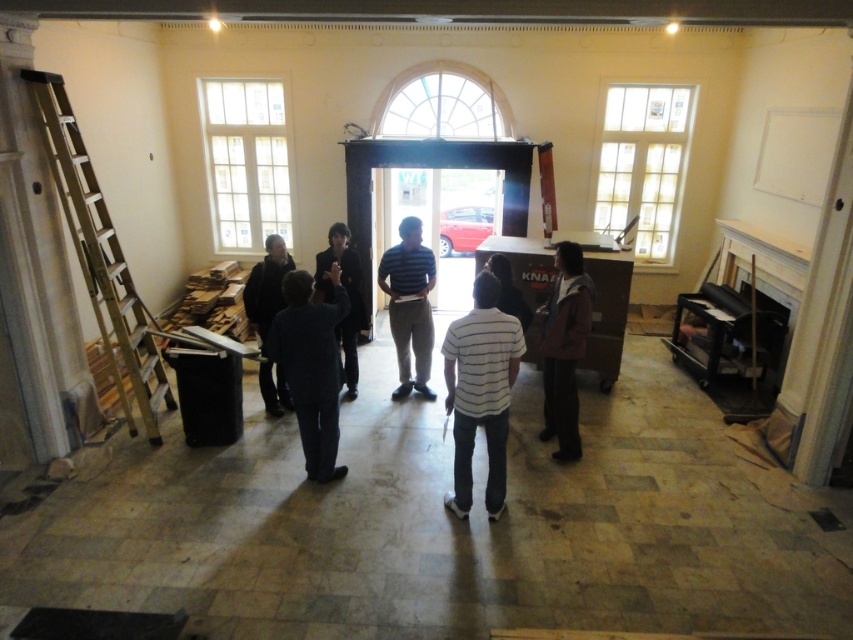
Question: Can you confirm if white striped shirt at center is positioned to the left of dark gray suit at center?

Choices:
 (A) no
 (B) yes

Answer: (A)

Question: Estimate the real-world distances between objects in this image. Which object is farther from the striped fabric shirt at center?

Choices:
 (A) white striped shirt at center
 (B) dark gray sweater at center
 (C) dark gray suit at center
 (D) metallic silver ladder at left

Answer: (D)

Question: Based on their relative distances, which object is farther from the metallic silver ladder at left?

Choices:
 (A) striped fabric shirt at center
 (B) dark gray suit at center

Answer: (A)

Question: Is dark gray sweater at center positioned behind dark brown leather jacket at center?

Choices:
 (A) no
 (B) yes

Answer: (B)

Question: Can you confirm if striped fabric shirt at center is bigger than dark gray sweater at center?

Choices:
 (A) yes
 (B) no

Answer: (A)

Question: Estimate the real-world distances between objects in this image. Which object is farther from the white striped shirt at center?

Choices:
 (A) dark gray sweater at center
 (B) striped fabric shirt at center
 (C) metallic silver ladder at left

Answer: (C)